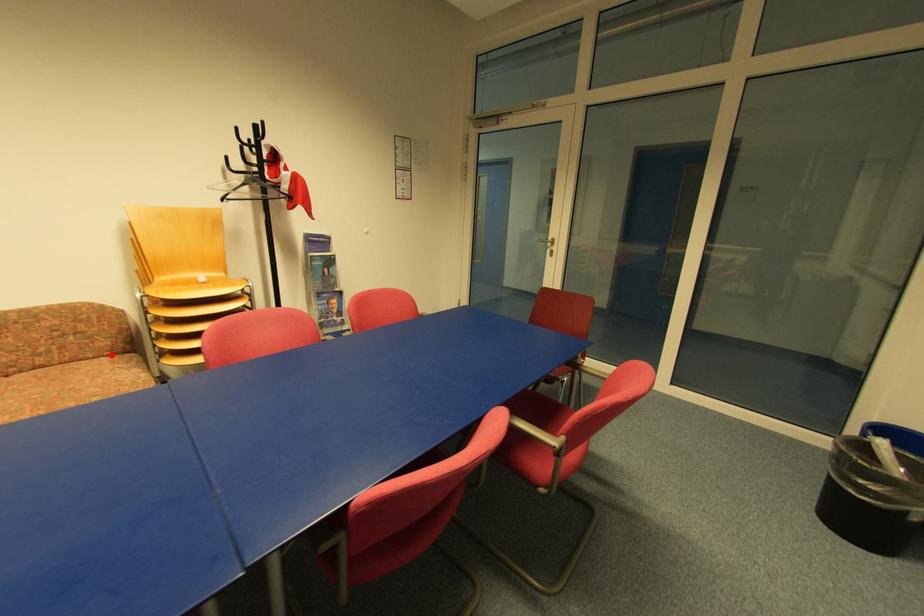
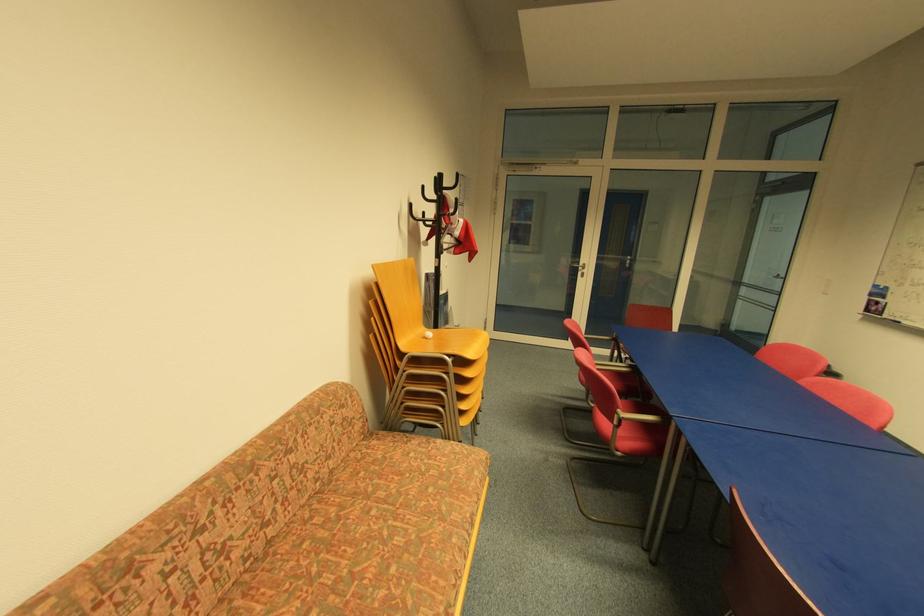
Question: I am providing you with two images of the same scene from different viewpoints. Given a red point in image1, look at the same physical point in image2. Is it:

Choices:
 (A) Closer to the viewpoint
 (B) Farther from the viewpoint

Answer: (A)